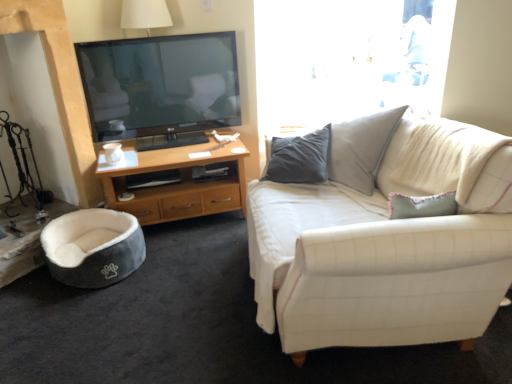
Measure the distance between white matte coffee cup at lower left and camera.

The distance of white matte coffee cup at lower left from camera is 2.58 meters.

Describe the element at coordinates (378, 260) in the screenshot. The width and height of the screenshot is (512, 384). I see `white fabric couch at right` at that location.

Locate an element on the screen. This screenshot has height=384, width=512. woodendesk at left is located at coordinates (177, 183).

At what (x,y) coordinates should I click in order to perform the action: click on bean bag chair below the white matte coffee cup at lower left (from a real-world perspective). Please return your answer as a coordinate pair (x, y). Looking at the image, I should click on (93, 247).

How far apart are velvet grey bean bag at lower left and white matte coffee cup at lower left?

velvet grey bean bag at lower left and white matte coffee cup at lower left are 20.46 inches apart.

Considering the relative positions of velvet grey bean bag at lower left and white matte coffee cup at lower left in the image provided, is velvet grey bean bag at lower left in front of white matte coffee cup at lower left?

Yes, velvet grey bean bag at lower left is closer to the camera.

In the scene shown: Which object is positioned more to the left, velvet grey bean bag at lower left or white matte coffee cup at lower left?

From the viewer's perspective, velvet grey bean bag at lower left appears more on the left side.

Which object is thinner, velvet grey bean bag at lower left or white fabric couch at right?

velvet grey bean bag at lower left.

Considering the points (56, 248) and (417, 262), which point is in front, point (56, 248) or point (417, 262)?

Positioned in front is point (417, 262).

Between velvet grey bean bag at lower left and white fabric couch at right, which one is positioned in front?

white fabric couch at right.

Are velvet grey bean bag at lower left and white fabric couch at right far apart?

Absolutely, velvet grey bean bag at lower left is distant from white fabric couch at right.

Can you confirm if woodendesk at left is shorter than white fabric couch at right?

Yes, woodendesk at left is shorter than white fabric couch at right.

Which is in front, point (149, 188) or point (321, 193)?

The point (321, 193) is closer.

From the image's perspective, is woodendesk at left above or below white fabric couch at right?

woodendesk at left is situated higher than white fabric couch at right in the image.

Can you tell me how much white fabric couch at right and velvet grey bean bag at lower left differ in facing direction?

There is a 136-degree angle between the facing directions of white fabric couch at right and velvet grey bean bag at lower left.

Does point (336, 147) appear closer or farther from the camera than point (103, 247)?

Point (336, 147) is closer to the camera than point (103, 247).

Would you say white fabric couch at right is to the left or to the right of velvet grey bean bag at lower left in the picture?

white fabric couch at right is to the right of velvet grey bean bag at lower left.

From the image's perspective, is white fabric couch at right located above or below velvet grey bean bag at lower left?

white fabric couch at right is situated higher than velvet grey bean bag at lower left in the image.

Based on the photo, which is farther, (213, 162) or (118, 154)?

Point (118, 154)

Is woodendesk at left bigger than white matte coffee cup at lower left?

Correct, woodendesk at left is larger in size than white matte coffee cup at lower left.

Between woodendesk at left and white matte coffee cup at lower left, which one appears on the left side from the viewer's perspective?

white matte coffee cup at lower left.

Can you confirm if woodendesk at left is thinner than velvet grey bean bag at lower left?

Incorrect, the width of woodendesk at left is not less than that of velvet grey bean bag at lower left.

Which point is more forward, (x=225, y=181) or (x=119, y=235)?

Point (x=119, y=235)

The width and height of the screenshot is (512, 384). Find the location of `desk behind the velvet grey bean bag at lower left`. desk behind the velvet grey bean bag at lower left is located at coordinates (177, 183).

Considering the positions of objects woodendesk at left and velvet grey bean bag at lower left in the image provided, who is more to the left, woodendesk at left or velvet grey bean bag at lower left?

From the viewer's perspective, velvet grey bean bag at lower left appears more on the left side.

Do you think white fabric couch at right is within woodendesk at left, or outside of it?

The correct answer is: outside.

Who is shorter, white fabric couch at right or woodendesk at left?

With less height is woodendesk at left.

Which is more to the left, white fabric couch at right or woodendesk at left?

woodendesk at left.

Which is further, (x=499, y=253) or (x=109, y=200)?

The point (x=109, y=200) is behind.

Where is `bean bag chair lying in front of the white matte coffee cup at lower left`? The width and height of the screenshot is (512, 384). bean bag chair lying in front of the white matte coffee cup at lower left is located at coordinates (93, 247).

Image resolution: width=512 pixels, height=384 pixels. I want to click on bean bag chair that appears below the white fabric couch at right (from a real-world perspective), so click(x=93, y=247).

Based on their spatial positions, is white matte coffee cup at lower left or woodendesk at left closer to velvet grey bean bag at lower left?

woodendesk at left is closer to velvet grey bean bag at lower left.

Which object lies nearer to the anchor point white matte coffee cup at lower left, white fabric couch at right or velvet grey bean bag at lower left?

velvet grey bean bag at lower left.

Considering their positions, is white fabric couch at right positioned further to velvet grey bean bag at lower left than white matte coffee cup at lower left?

white fabric couch at right is positioned further to the anchor velvet grey bean bag at lower left.

Which object lies nearer to the anchor point white fabric couch at right, woodendesk at left or velvet grey bean bag at lower left?

The object closer to white fabric couch at right is woodendesk at left.

When comparing their distances from woodendesk at left, does white matte coffee cup at lower left or velvet grey bean bag at lower left seem further?

white matte coffee cup at lower left is positioned further to the anchor woodendesk at left.

Estimate the real-world distances between objects in this image. Which object is closer to velvet grey bean bag at lower left, white fabric couch at right or woodendesk at left?

The object closer to velvet grey bean bag at lower left is woodendesk at left.

When comparing their distances from white matte coffee cup at lower left, does woodendesk at left or white fabric couch at right seem closer?

Among the two, woodendesk at left is located nearer to white matte coffee cup at lower left.

In the scene shown: When comparing their distances from white fabric couch at right, does velvet grey bean bag at lower left or woodendesk at left seem further?

velvet grey bean bag at lower left.

Where is `desk between velvet grey bean bag at lower left and white fabric couch at right from left to right`? desk between velvet grey bean bag at lower left and white fabric couch at right from left to right is located at coordinates (177, 183).

Where is `desk between white matte coffee cup at lower left and velvet grey bean bag at lower left in the vertical direction`? The height and width of the screenshot is (384, 512). desk between white matte coffee cup at lower left and velvet grey bean bag at lower left in the vertical direction is located at coordinates (177, 183).

Find the location of `desk located between white fabric couch at right and white matte coffee cup at lower left in the depth direction`. desk located between white fabric couch at right and white matte coffee cup at lower left in the depth direction is located at coordinates (177, 183).

Locate an element on the screen. Image resolution: width=512 pixels, height=384 pixels. coffee cup between velvet grey bean bag at lower left and white fabric couch at right from left to right is located at coordinates (113, 153).